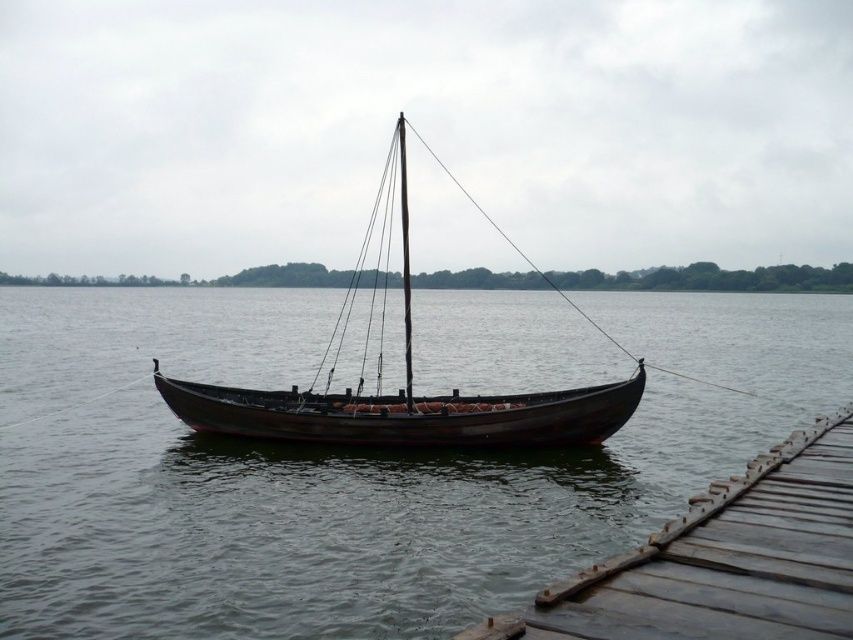
Looking at this image, can you confirm if rustic wood sailboat at center is wider than wooden canoe at center?

Yes.

Between point (431, 154) and point (404, 420), which one is positioned behind?

Point (431, 154)

Locate an element on the screen. rustic wood sailboat at center is located at coordinates (404, 376).

Does brown wooden water at center appear on the left side of wooden canoe at center?

No, brown wooden water at center is not to the left of wooden canoe at center.

Does brown wooden water at center have a lesser height compared to wooden canoe at center?

No, brown wooden water at center is not shorter than wooden canoe at center.

Locate an element on the screen. This screenshot has width=853, height=640. brown wooden water at center is located at coordinates (347, 467).

Find the location of a particular element. brown wooden water at center is located at coordinates (347, 467).

Is point (460, 346) positioned behind point (379, 198)?

That is False.

Can you confirm if brown wooden water at center is bigger than rustic wood sailboat at center?

Actually, brown wooden water at center might be smaller than rustic wood sailboat at center.

This screenshot has width=853, height=640. What do you see at coordinates (347, 467) in the screenshot?
I see `brown wooden water at center` at bounding box center [347, 467].

The image size is (853, 640). What are the coordinates of `brown wooden water at center` in the screenshot? It's located at (347, 467).